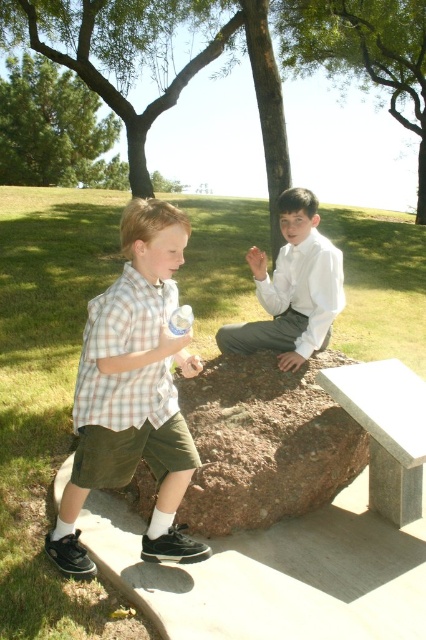
You are a photographer trying to capture a candid shot of the plaid cotton shirt at left without the clear plastic bottle at center appearing in the frame. Based on their positions, can you position yourself in a way to exclude the bottle from the photo?

The clear plastic bottle at center is behind the plaid cotton shirt at left, so you can position yourself in front of the plaid cotton shirt at left to block the view of the clear plastic bottle at center and take the photo without it appearing in the frame.

You are a photographer trying to capture a candid shot of the two boys in the park. You notice the white satin shirt at center and the clear plastic bottle at center. Which object should you focus on first if you want to ensure both are in focus without adjusting your camera settings?

The white satin shirt at center is above the clear plastic bottle at center, so focusing on the white satin shirt at center first will ensure both are in focus since it is closer to the camera.